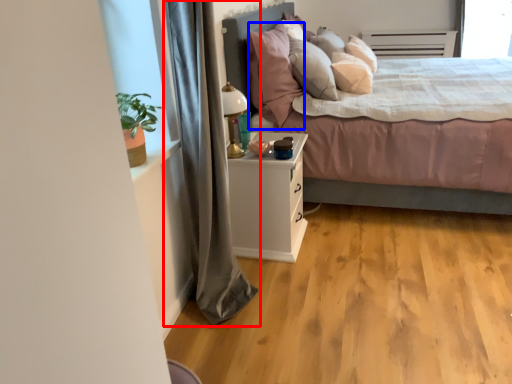
Question: Which of the following is the farthest to the observer, curtain (highlighted by a red box) or pillow (highlighted by a blue box)?

Choices:
 (A) curtain
 (B) pillow

Answer: (B)